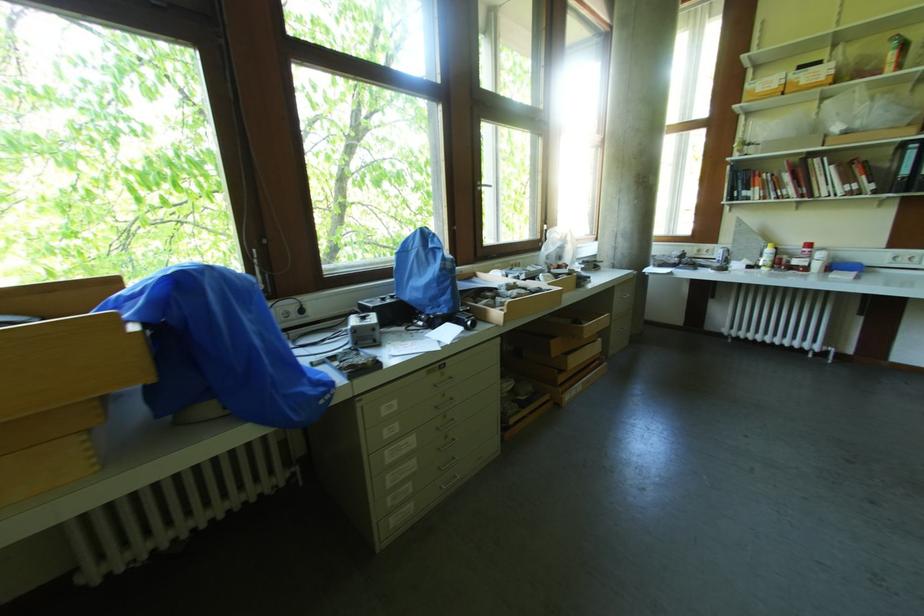
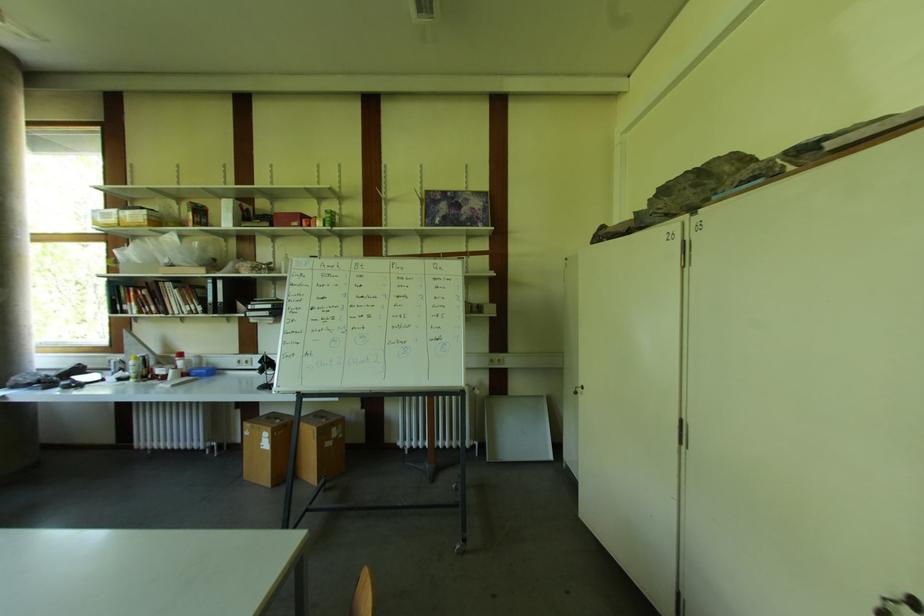
The point at (811, 246) is marked in the first image. Where is the corresponding point in the second image?

(184, 357)